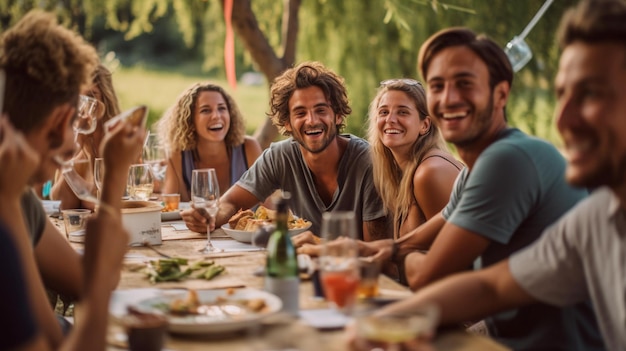
This screenshot has height=351, width=626. Identify the location of wine glasses. (203, 178), (136, 168), (99, 165), (86, 106), (81, 187), (342, 253).